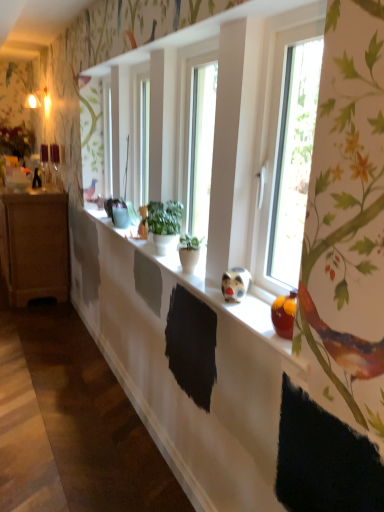
Question: Should I look upward or downward to see matte brown cabinet at left?

Choices:
 (A) up
 (B) down

Answer: (A)

Question: From the image's perspective, is white matte window sill at center below green matte plant at center, the first houseplant from the back?

Choices:
 (A) yes
 (B) no

Answer: (A)

Question: Is white matte window sill at center taller than green matte plant at center, the first houseplant from the back?

Choices:
 (A) no
 (B) yes

Answer: (A)

Question: Can you confirm if white matte window sill at center is shorter than green matte plant at center, placed as the second houseplant when sorted from front to back?

Choices:
 (A) no
 (B) yes

Answer: (B)

Question: Does white matte window sill at center come in front of green matte plant at center, placed as the second houseplant when sorted from front to back?

Choices:
 (A) no
 (B) yes

Answer: (B)

Question: From the image's perspective, is white matte window sill at center above green matte plant at center, placed as the second houseplant when sorted from front to back?

Choices:
 (A) no
 (B) yes

Answer: (A)

Question: Is white matte window sill at center oriented away from green matte plant at center, placed as the second houseplant when sorted from front to back?

Choices:
 (A) no
 (B) yes

Answer: (A)

Question: Can you confirm if green matte plant pot at center, positioned as the second houseplant in back-to-front order, is positioned to the right of white matte window sill at center?

Choices:
 (A) yes
 (B) no

Answer: (A)

Question: From a real-world perspective, is green matte plant pot at center, positioned as the second houseplant in back-to-front order, physically above white matte window sill at center?

Choices:
 (A) yes
 (B) no

Answer: (A)

Question: Is white matte window sill at center inside green matte plant pot at center, positioned as the second houseplant in back-to-front order?

Choices:
 (A) yes
 (B) no

Answer: (B)

Question: Does green matte plant pot at center, positioned as the second houseplant in back-to-front order, have a lesser width compared to white matte window sill at center?

Choices:
 (A) yes
 (B) no

Answer: (A)

Question: Considering the relative positions of green matte plant pot at center, positioned as the second houseplant in back-to-front order, and white matte window sill at center in the image provided, is green matte plant pot at center, positioned as the second houseplant in back-to-front order, in front of white matte window sill at center?

Choices:
 (A) no
 (B) yes

Answer: (A)

Question: Is green matte plant pot at center, which is counted as the 1th houseplant, starting from the front, oriented towards white matte window sill at center?

Choices:
 (A) yes
 (B) no

Answer: (B)

Question: Is green matte plant at center, placed as the second houseplant when sorted from front to back, shorter than green matte plant pot at center, which is counted as the 1th houseplant, starting from the front?

Choices:
 (A) yes
 (B) no

Answer: (B)